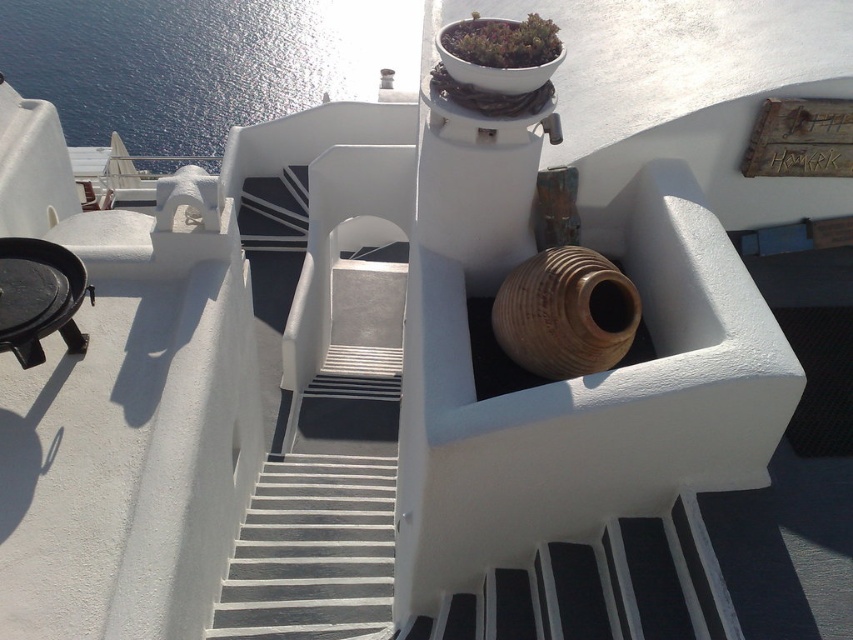
You are standing at the bottom of the staircase and looking up towards the building. Which direction should you look to see the blue water at upper left?

The blue water at upper left is located at point [199,61], so you should look towards the upper left direction to see it.

You are a visitor at this Mediterranean building and want to take a photo of the blue water at upper left and the green matte pot at upper center. Which object should you focus on first if you want to capture both in a single frame without moving the camera?

The blue water at upper left is larger in size than the green matte pot at upper center, so you should focus on the blue water at upper left first to ensure it fits properly in the frame.